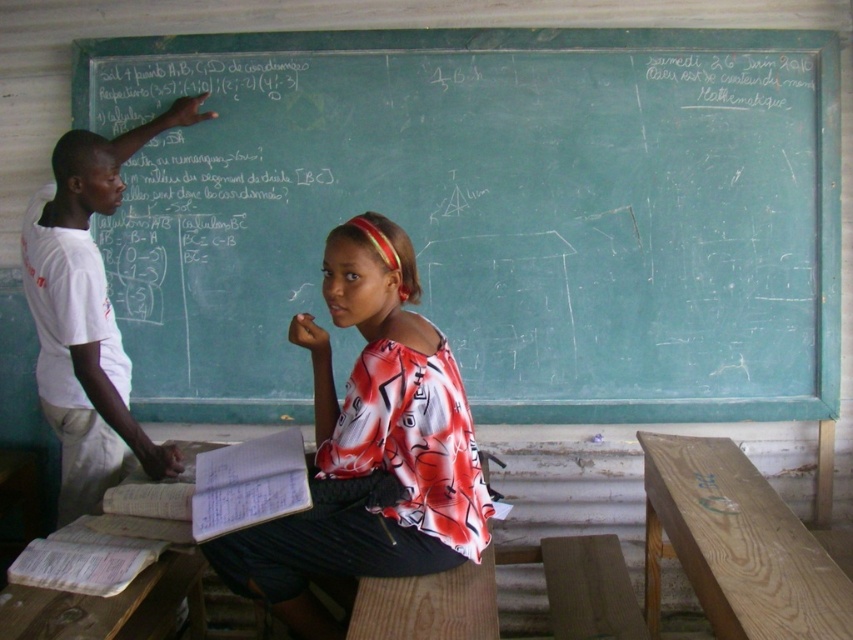
Between green chalkboard at upper center and printed fabric shirt at center, which one has less height?

With less height is printed fabric shirt at center.

Is point (793, 330) farther from camera compared to point (250, 580)?

Yes, it is behind point (250, 580).

You are a GUI agent. You are given a task and a screenshot of the screen. Output one action in this format:
    pyautogui.click(x=<x>, y=<y>)
    Task: Click on the green chalkboard at upper center
    
    Given the screenshot: What is the action you would take?
    pyautogui.click(x=488, y=212)

Between white t-shirt at left and light brown wooden table at right, which one is positioned higher?

Positioned higher is white t-shirt at left.

Between point (91, 173) and point (734, 545), which one is positioned behind?

Point (91, 173)

I want to click on white t-shirt at left, so click(x=86, y=314).

Who is higher up, green chalkboard at upper center or light brown wooden table at right?

green chalkboard at upper center is higher up.

Does green chalkboard at upper center come in front of light brown wooden table at right?

No, it is behind light brown wooden table at right.

Who is more distant from viewer, (308,97) or (737,608)?

Point (308,97)

At what (x,y) coordinates should I click in order to perform the action: click on green chalkboard at upper center. Please return your answer as a coordinate pair (x, y). The image size is (853, 640). Looking at the image, I should click on (488, 212).